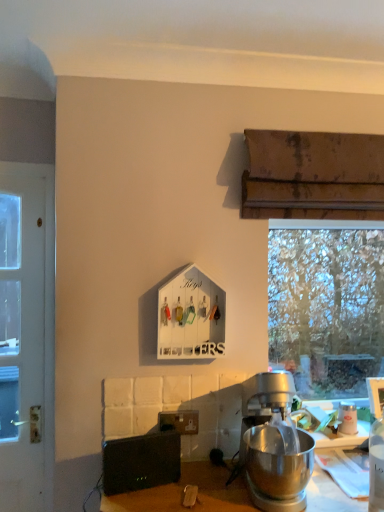
Question: Considering the relative positions of white glossy coffee cup at upper right and black plastic speaker at lower left in the image provided, is white glossy coffee cup at upper right to the left or to the right of black plastic speaker at lower left?

Choices:
 (A) right
 (B) left

Answer: (A)

Question: Is white glossy coffee cup at upper right in front of or behind black plastic speaker at lower left in the image?

Choices:
 (A) behind
 (B) front

Answer: (A)

Question: Which is farther from the black plastic speaker at lower left?

Choices:
 (A) transparent glass window at right
 (B) white glossy coffee cup at upper right
 (C) white painted wood door at left

Answer: (A)

Question: Which of these objects is positioned closest to the white glossy coffee cup at upper right?

Choices:
 (A) black plastic speaker at lower left
 (B) white painted wood door at left
 (C) transparent glass window at right

Answer: (A)